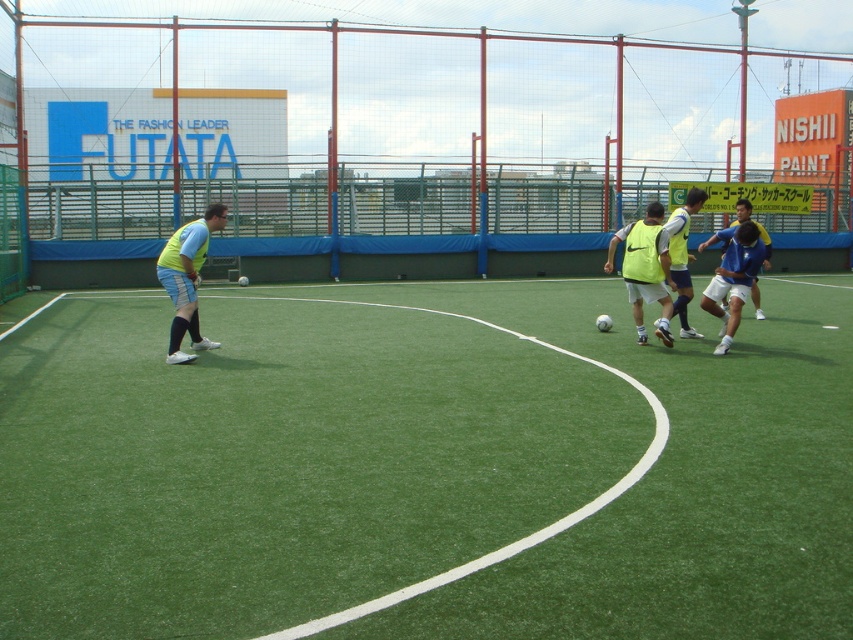
You are a soccer player standing on the green artificial turf at center. You see the blue matte soccer ball at center. Which object is closer to the ground?

The green artificial turf at center is below the blue matte soccer ball at center, so the green artificial turf at center is closer to the ground.

You are a spectator at the soccer match and want to take a photo that includes both the green artificial turf at center and the matte yellow vest at center. Based on their positions, which object should you place on the left side of your camera frame to ensure both are in the shot?

The green artificial turf at center is to the left of the matte yellow vest at center, so you should place the green artificial turf at center on the left side of your camera frame to include both in the shot.

From the picture: You are a soccer coach observing the field. You notice the green artificial turf at center and the matte yellow vest at left. Which object is taller?

The matte yellow vest at left is taller than the green artificial turf at center.